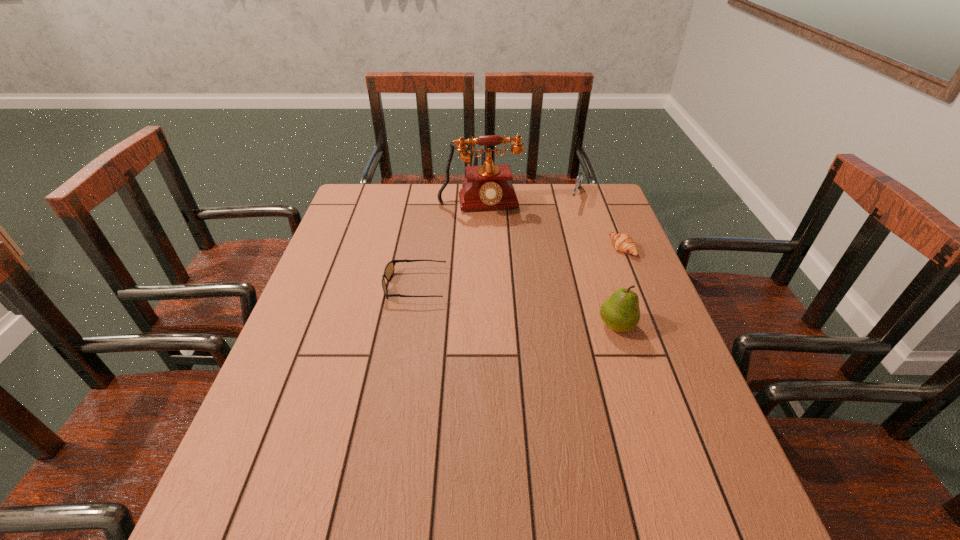
Where is `free space located on the dial of the telephone`? This screenshot has width=960, height=540. free space located on the dial of the telephone is located at coordinates (492, 265).

Find the location of a particular element. The height and width of the screenshot is (540, 960). vacant space located 0.400m on the dial of the telephone is located at coordinates (500, 303).

Image resolution: width=960 pixels, height=540 pixels. What are the coordinates of `vacant point located 0.150m on the dial of the telephone` in the screenshot? It's located at (489, 246).

Find the location of `vacant region located on the front-facing side of the pastry`. vacant region located on the front-facing side of the pastry is located at coordinates (602, 259).

Where is `vacant space located 0.230m on the front-facing side of the pastry`? This screenshot has height=540, width=960. vacant space located 0.230m on the front-facing side of the pastry is located at coordinates (551, 279).

You are a GUI agent. You are given a task and a screenshot of the screen. Output one action in this format:
    pyautogui.click(x=<x>, y=<y>)
    Task: Click on the free space located on the front-facing side of the pastry
    The image size is (960, 540).
    Given the screenshot: What is the action you would take?
    pyautogui.click(x=557, y=276)

You are a GUI agent. You are given a task and a screenshot of the screen. Output one action in this format:
    pyautogui.click(x=<x>, y=<y>)
    Task: Click on the free region located on the front-facing side of the third shortest object
    This screenshot has width=960, height=540.
    Given the screenshot: What is the action you would take?
    pyautogui.click(x=568, y=237)

Locate an element on the screen. This screenshot has width=960, height=540. blank space located 0.200m on the front-facing side of the third shortest object is located at coordinates (566, 245).

The image size is (960, 540). What are the coordinates of `vacant point located on the front-facing side of the third shortest object` in the screenshot? It's located at (563, 256).

Image resolution: width=960 pixels, height=540 pixels. In order to click on telephone at the far edge in this screenshot , I will do `click(489, 186)`.